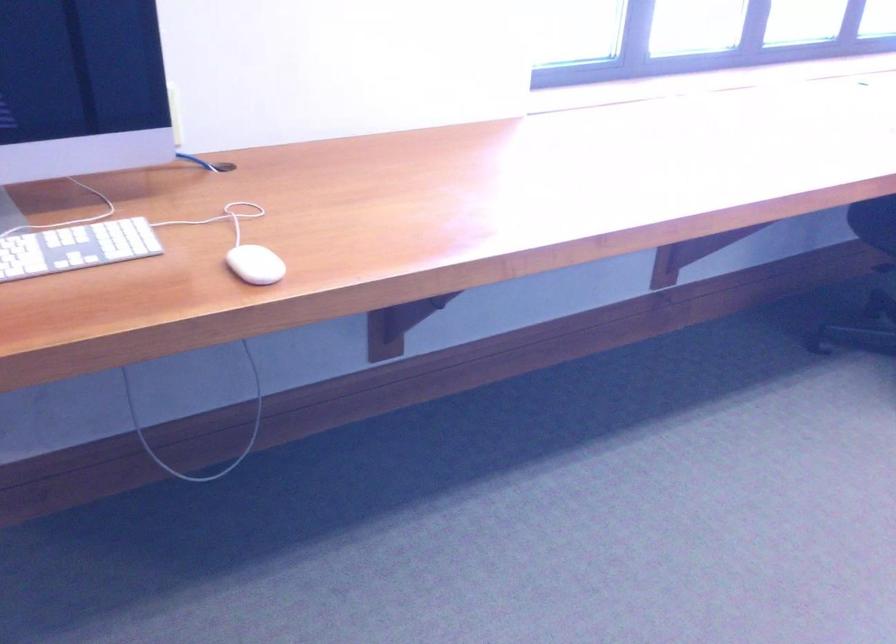
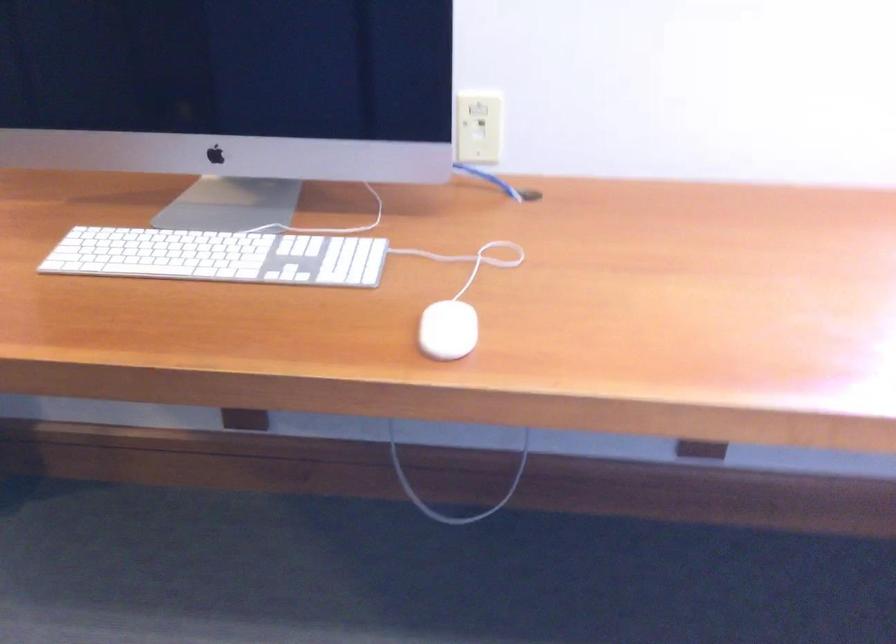
Question: How did the camera likely rotate?

Choices:
 (A) Left
 (B) Right
 (C) Up
 (D) Down

Answer: (A)